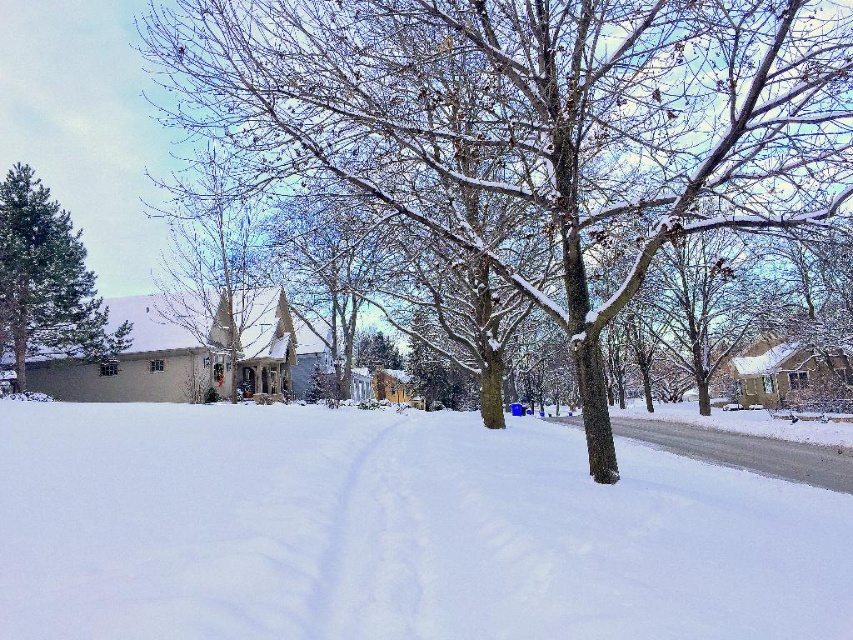
Is white fluffy snow at center closer to camera compared to green matte tree at upper left?

Yes.

Which is in front, point (735, 579) or point (51, 339)?

Point (735, 579)

I want to click on white fluffy snow at center, so click(393, 531).

In the scene shown: Is white fluffy snow at center bigger than snow-covered tree at center?

Incorrect, white fluffy snow at center is not larger than snow-covered tree at center.

Who is shorter, white fluffy snow at center or snow-covered tree at center?

white fluffy snow at center is shorter.

Between point (427, 588) and point (488, 193), which one is positioned behind?

Point (488, 193)

The height and width of the screenshot is (640, 853). Find the location of `white fluffy snow at center`. white fluffy snow at center is located at coordinates (393, 531).

Does snow-covered tree at center have a greater width compared to green matte tree at upper left?

Correct, the width of snow-covered tree at center exceeds that of green matte tree at upper left.

Is snow-covered tree at center to the right of green matte tree at upper left from the viewer's perspective?

Indeed, snow-covered tree at center is positioned on the right side of green matte tree at upper left.

Is point (496, 99) more distant than point (19, 232)?

No, (496, 99) is in front of (19, 232).

Where is `snow-covered tree at center`? This screenshot has height=640, width=853. snow-covered tree at center is located at coordinates (534, 122).